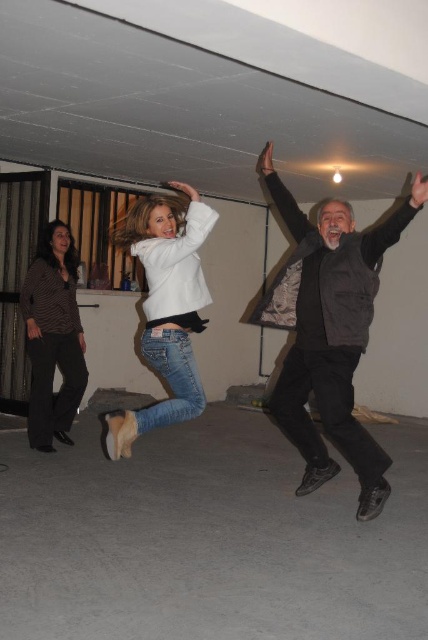
In the scene shown: How much distance is there between white matte jacket at center and black matte arm at upper center?

A distance of 1.01 meters exists between white matte jacket at center and black matte arm at upper center.

Between point (154, 348) and point (303, 212), which one is positioned behind?

The point (303, 212) is behind.

Which is behind, point (155, 324) or point (291, 204)?

Point (291, 204)

Where is `white matte jacket at center`? The height and width of the screenshot is (640, 428). white matte jacket at center is located at coordinates (166, 307).

Does striped jersey pants at left appear on the right side of denim jeans at center?

Incorrect, striped jersey pants at left is not on the right side of denim jeans at center.

Between point (50, 340) and point (190, 371), which one is positioned in front?

Point (190, 371) is in front.

The width and height of the screenshot is (428, 640). Describe the element at coordinates (53, 337) in the screenshot. I see `striped jersey pants at left` at that location.

Where is `striped jersey pants at left`? striped jersey pants at left is located at coordinates (53, 337).

Is striped jersey pants at left further to camera compared to dark brown knitted sweater at left?

That is True.

This screenshot has height=640, width=428. What do you see at coordinates (53, 337) in the screenshot?
I see `striped jersey pants at left` at bounding box center [53, 337].

What do you see at coordinates (53, 337) in the screenshot? The height and width of the screenshot is (640, 428). I see `striped jersey pants at left` at bounding box center [53, 337].

Where is `striped jersey pants at left`? The height and width of the screenshot is (640, 428). striped jersey pants at left is located at coordinates (53, 337).